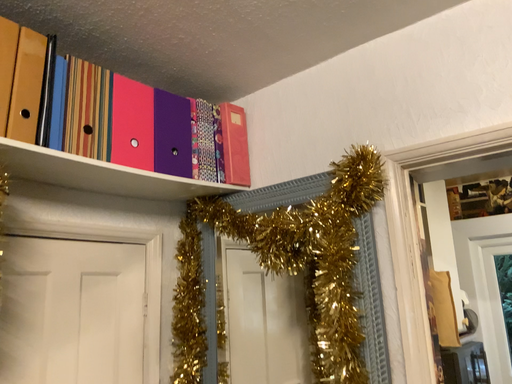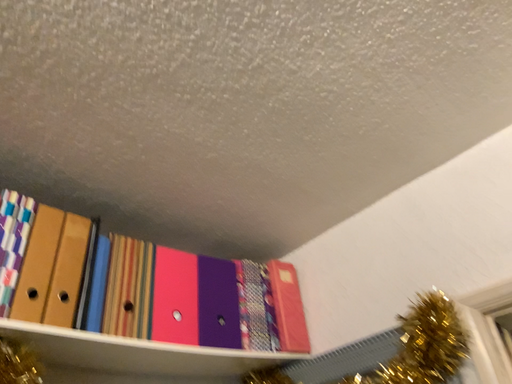
Question: How did the camera likely rotate when shooting the video?

Choices:
 (A) rotated left
 (B) rotated right

Answer: (A)